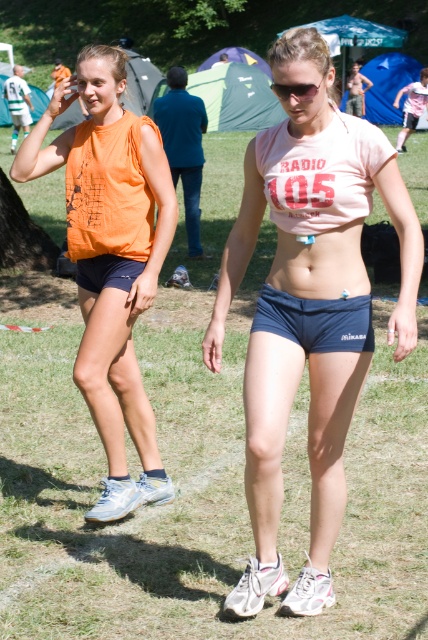
Question: In this image, where is matte pink t-shirt at center located relative to pink matte bikini top at center?

Choices:
 (A) left
 (B) right

Answer: (A)

Question: Considering the real-world distances, which object is farthest from the orange fabric tank top at left?

Choices:
 (A) pink matte bikini top at center
 (B) matte pink t-shirt at center

Answer: (A)

Question: Estimate the real-world distances between objects in this image. Which object is farther from the blue fabric shorts at lower left?

Choices:
 (A) navy blue shorts at center
 (B) sunglasses at center
 (C) matte pink t-shirt at center

Answer: (B)

Question: Does matte pink t-shirt at center appear over sunglasses at center?

Choices:
 (A) no
 (B) yes

Answer: (A)

Question: Does orange fabric tank top at left have a larger size compared to pink matte bikini top at center?

Choices:
 (A) yes
 (B) no

Answer: (A)

Question: Which object is closer to the camera taking this photo?

Choices:
 (A) pink matte bikini top at center
 (B) blue fabric shorts at lower left
 (C) orange fabric tank top at left

Answer: (A)